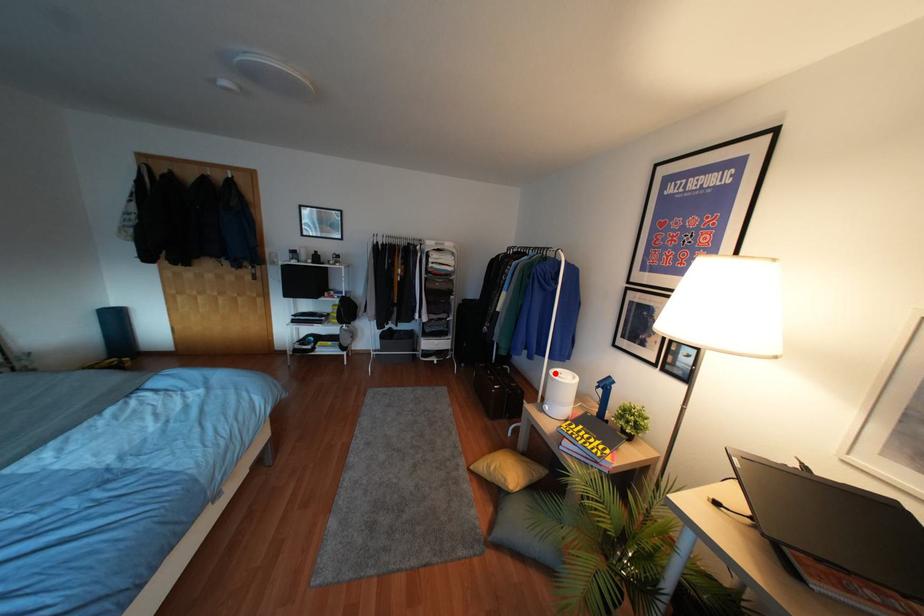
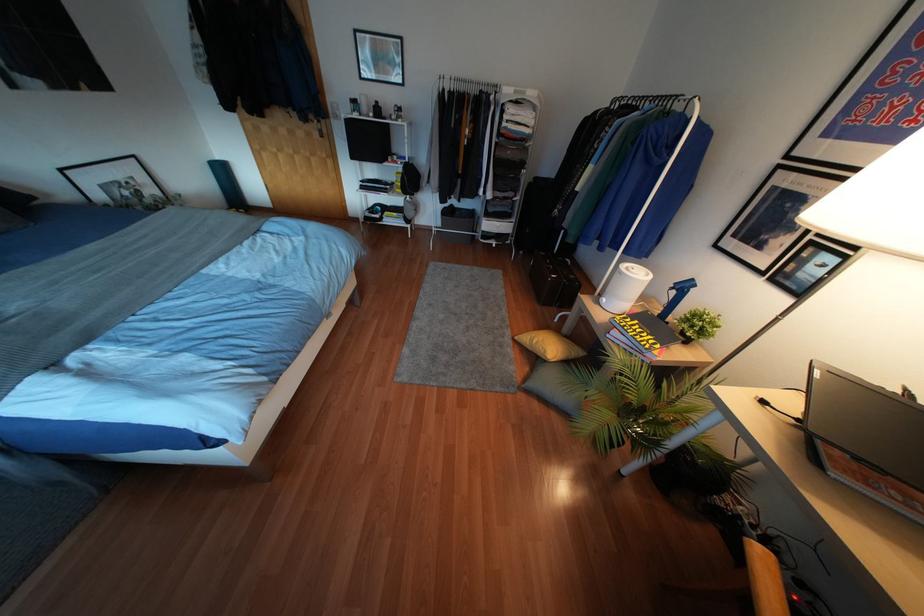
Question: A red point is marked in image1. In image2, is the corresponding 3D point closer to the camera or farther? Reply with the corresponding letter.

Choices:
 (A) The corresponding 3D point is closer.
 (B) The corresponding 3D point is farther.

Answer: (A)